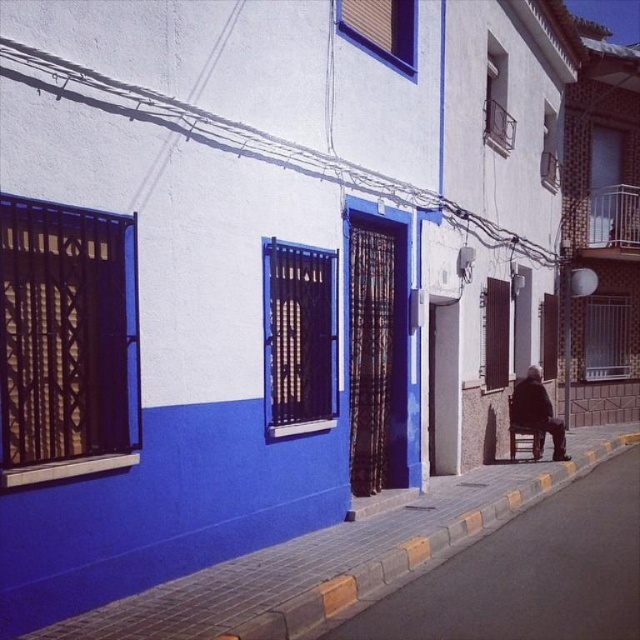
Question: Is smooth concrete pavement at lower center thinner than dark brown leather jacket at lower right?

Choices:
 (A) yes
 (B) no

Answer: (B)

Question: Does smooth concrete pavement at lower center lie in front of dark brown leather jacket at lower right?

Choices:
 (A) no
 (B) yes

Answer: (B)

Question: Can you confirm if smooth concrete pavement at lower center is positioned above dark brown leather jacket at lower right?

Choices:
 (A) yes
 (B) no

Answer: (B)

Question: Which object appears farthest from the camera in this image?

Choices:
 (A) smooth concrete pavement at lower center
 (B) dark brown leather jacket at lower right

Answer: (B)

Question: Which object appears closest to the camera in this image?

Choices:
 (A) smooth concrete pavement at lower center
 (B) dark brown leather jacket at lower right

Answer: (A)